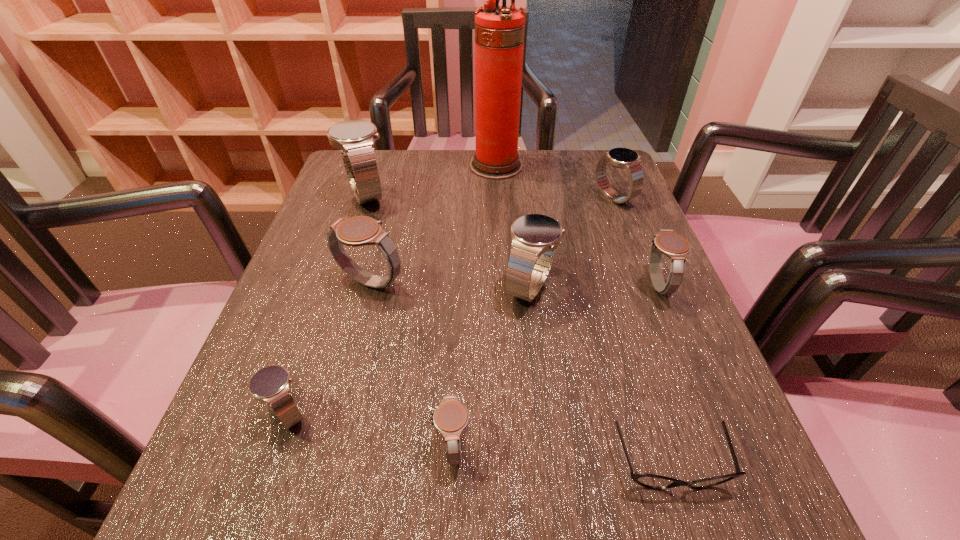
The height and width of the screenshot is (540, 960). Identify the location of blue watch that stands as the fourth closest to the second biggest gray watch. (271, 384).

Identify which gray watch is the third nearest to the fire extinguisher. Please provide its 2D coordinates. Your answer should be formatted as a tuple, i.e. [(x, y)], where the tuple contains the x and y coordinates of a point satisfying the conditions above.

[(450, 418)]

Find the location of `gray watch that stands as the third closest to the second blue watch from right to left`. gray watch that stands as the third closest to the second blue watch from right to left is located at coordinates (450, 418).

Identify the location of free region that satisfies the following two spatial constraints: 1. at the discharge end of the tallest object; 2. on the right side of the fifth watch from left to right. (502, 287).